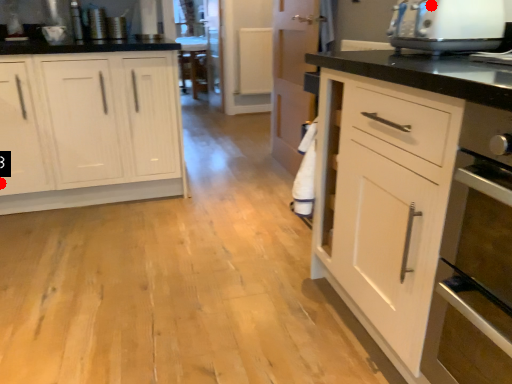
Question: Two points are circled on the image, labeled by A and B beside each circle. Which point is further to the camera?

Choices:
 (A) A is further
 (B) B is further

Answer: (B)